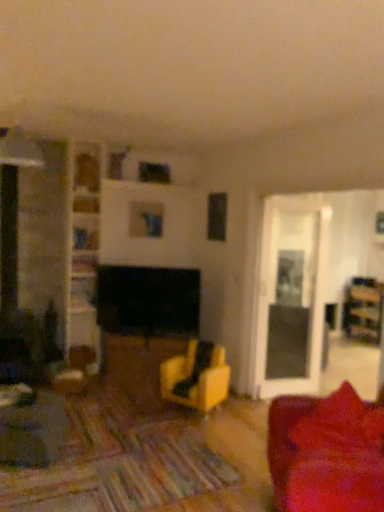
Question: Is matte wood table at center at the right side of wooden shelf at upper center, which is the 1th shelf from top to bottom?

Choices:
 (A) yes
 (B) no

Answer: (A)

Question: Is wooden shelf at upper center, which is the 1th shelf from top to bottom, located within matte wood table at center?

Choices:
 (A) no
 (B) yes

Answer: (A)

Question: Could you tell me if matte wood table at center is turned towards wooden shelf at upper center, which is the 1th shelf from top to bottom?

Choices:
 (A) no
 (B) yes

Answer: (A)

Question: Considering the relative sizes of matte wood table at center and wooden shelf at upper center, which ranks as the fourth shelf in bottom-to-top order, in the image provided, is matte wood table at center taller than wooden shelf at upper center, which ranks as the fourth shelf in bottom-to-top order,?

Choices:
 (A) no
 (B) yes

Answer: (B)

Question: Can you confirm if matte wood table at center is thinner than wooden shelf at upper center, which is the 1th shelf from top to bottom?

Choices:
 (A) yes
 (B) no

Answer: (B)

Question: Is matte wood table at center wider than wooden shelf at upper center, which ranks as the fourth shelf in bottom-to-top order?

Choices:
 (A) yes
 (B) no

Answer: (A)

Question: From a real-world perspective, is matte yellow chair at center physically below wooden bookshelf at left, which is the first shelf from bottom to top?

Choices:
 (A) yes
 (B) no

Answer: (A)

Question: Are matte yellow chair at center and wooden bookshelf at left, the fourth shelf when ordered from top to bottom, making contact?

Choices:
 (A) no
 (B) yes

Answer: (A)

Question: Is matte yellow chair at center smaller than wooden bookshelf at left, the fourth shelf when ordered from top to bottom?

Choices:
 (A) yes
 (B) no

Answer: (B)

Question: From the image's perspective, would you say matte yellow chair at center is shown under wooden bookshelf at left, which is the first shelf from bottom to top?

Choices:
 (A) no
 (B) yes

Answer: (B)

Question: Is matte yellow chair at center not within wooden bookshelf at left, the fourth shelf when ordered from top to bottom?

Choices:
 (A) no
 (B) yes

Answer: (B)

Question: Considering the relative positions of matte yellow chair at center and wooden bookshelf at left, the fourth shelf when ordered from top to bottom, in the image provided, is matte yellow chair at center to the right of wooden bookshelf at left, the fourth shelf when ordered from top to bottom, from the viewer's perspective?

Choices:
 (A) no
 (B) yes

Answer: (B)

Question: From the image's perspective, does wooden bookshelf at center, the 3th shelf when ordered from top to bottom, appear lower than wooden shelf at upper center, which is the 1th shelf from top to bottom?

Choices:
 (A) no
 (B) yes

Answer: (B)